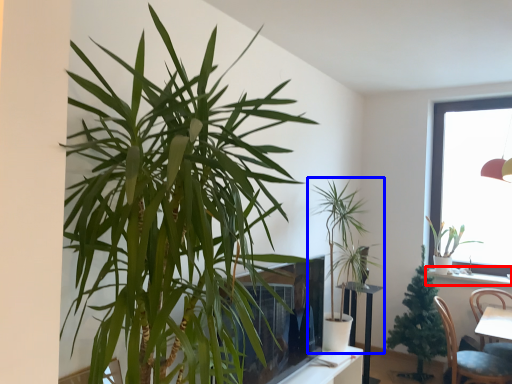
Question: Which point is further to the camera, window sill (highlighted by a red box) or houseplant (highlighted by a blue box)?

Choices:
 (A) window sill
 (B) houseplant

Answer: (A)